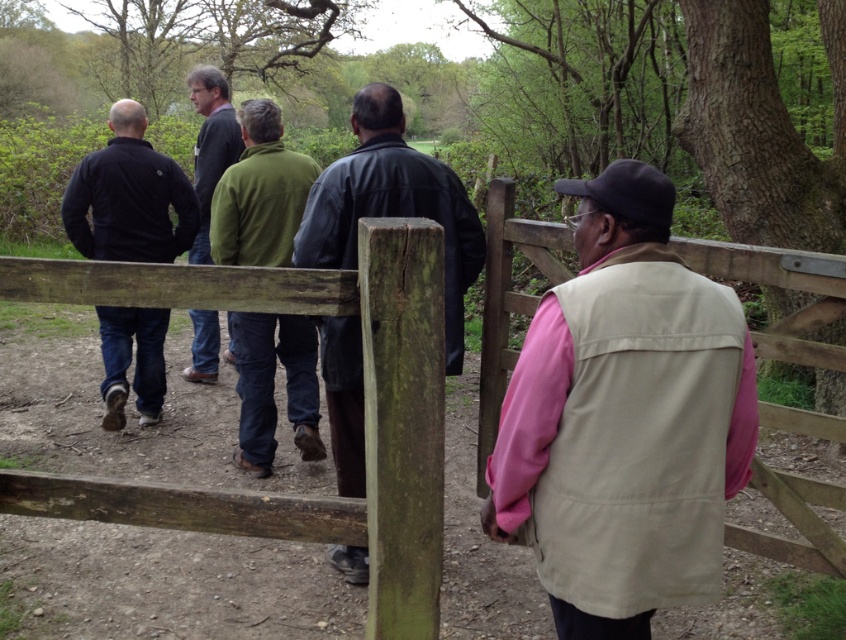
Who is shorter, wooden fence at center or leather jacket at center?

wooden fence at center

Is wooden fence at center positioned behind leather jacket at center?

No, it is in front of leather jacket at center.

Is point (294, 538) more distant than point (361, 147)?

No, (294, 538) is closer to viewer.

This screenshot has width=846, height=640. Find the location of `wooden fence at center`. wooden fence at center is located at coordinates (367, 420).

Does beige fabric vest at right have a smaller size compared to dark blue jacket at left?

Incorrect, beige fabric vest at right is not smaller in size than dark blue jacket at left.

The width and height of the screenshot is (846, 640). Describe the element at coordinates (624, 419) in the screenshot. I see `beige fabric vest at right` at that location.

The width and height of the screenshot is (846, 640). I want to click on beige fabric vest at right, so click(624, 419).

Does green mossy wood at center appear on the right side of leather jacket at center?

Indeed, green mossy wood at center is positioned on the right side of leather jacket at center.

What do you see at coordinates (402, 422) in the screenshot? The height and width of the screenshot is (640, 846). I see `green mossy wood at center` at bounding box center [402, 422].

Identify the location of green mossy wood at center. (402, 422).